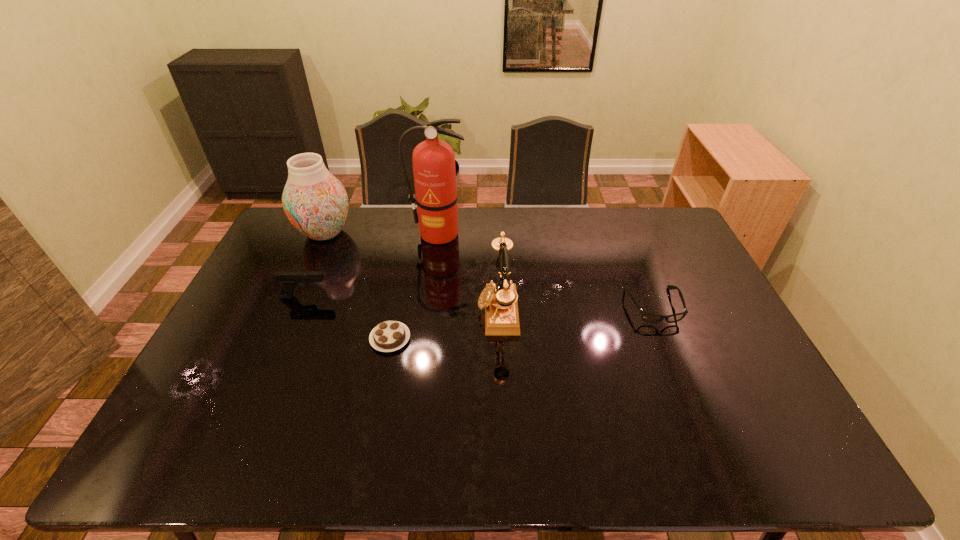
Locate an element on the screen. This screenshot has height=540, width=960. object at the right edge is located at coordinates (648, 317).

In order to click on object that is at the far left corner in this screenshot , I will do `click(316, 203)`.

Where is `vacant region at the far edge of the desktop`? The height and width of the screenshot is (540, 960). vacant region at the far edge of the desktop is located at coordinates (375, 214).

Locate an element on the screen. vacant space at the near edge is located at coordinates (626, 461).

Locate an element on the screen. The image size is (960, 540). vacant space at the left edge of the desktop is located at coordinates (267, 357).

Locate an element on the screen. free space at the right edge is located at coordinates (718, 310).

Locate an element on the screen. The height and width of the screenshot is (540, 960). free location at the far left corner is located at coordinates (304, 240).

Locate an element on the screen. This screenshot has height=540, width=960. free location at the far right corner of the desktop is located at coordinates (638, 209).

Locate an element on the screen. free spot between the chocolate cake and the rightmost object is located at coordinates (522, 322).

Where is `unoccupied area between the fire extinguisher and the telephone`? The image size is (960, 540). unoccupied area between the fire extinguisher and the telephone is located at coordinates (468, 272).